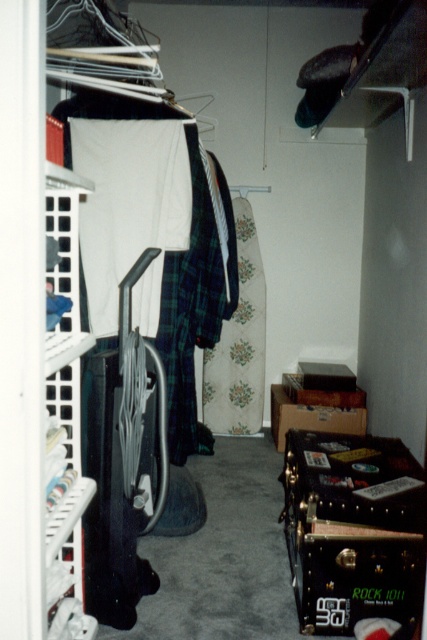
You are trying to reach two points in the closet. One is point [105,186] and the other is point [262,403]. Which point is easier to reach because it is closer to you?

Point [105,186] is closer to the viewer than point [262,403], so it is easier to reach.

You are organizing the closet and need to move the floral fabric dress at center to the right side. Which direction should you move it relative to the white fabric at center?

You should move the floral fabric dress at center to the right of the white fabric at center since currently, the white fabric at center is to the left of floral fabric dress at center.

You are organizing the closet and need to know which item is wider between the white fabric at center and the floral fabric dress at center. Which one is wider?

The white fabric at center is wider than the floral fabric dress at center according to the description.